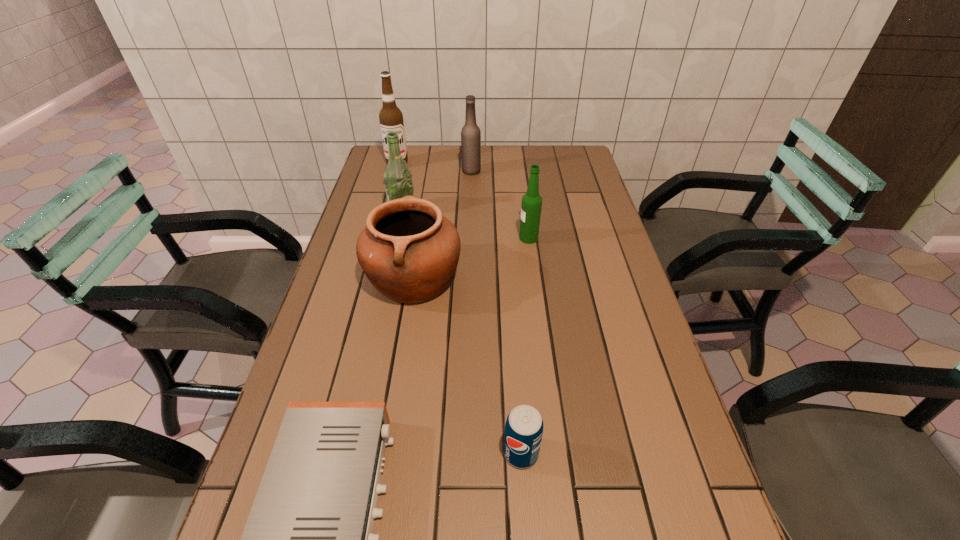
You are a GUI agent. You are given a task and a screenshot of the screen. Output one action in this format:
    pyautogui.click(x=<x>, y=<y>)
    Task: Click on the tallest object
    
    Given the screenshot: What is the action you would take?
    pyautogui.click(x=391, y=118)

Where is `the farthest beer bottle`? This screenshot has width=960, height=540. the farthest beer bottle is located at coordinates (470, 134).

I want to click on the third farthest object, so click(397, 178).

Where is `the leftmost beer bottle`? the leftmost beer bottle is located at coordinates tap(397, 178).

The image size is (960, 540). In order to click on the nearest beer bottle in this screenshot , I will do `click(531, 205)`.

Identify the location of the fourth nearest object. (531, 205).

Locate an element on the screen. Image resolution: width=960 pixels, height=540 pixels. the fifth tallest object is located at coordinates (409, 251).

Where is `the fifth farthest object`? the fifth farthest object is located at coordinates (409, 251).

Identify the location of the sixth tallest object. This screenshot has width=960, height=540. (524, 426).

At what (x,y) coordinates should I click in order to perform the action: click on the sixth object from left to right. Please return your answer as a coordinate pair (x, y). Image resolution: width=960 pixels, height=540 pixels. Looking at the image, I should click on (524, 426).